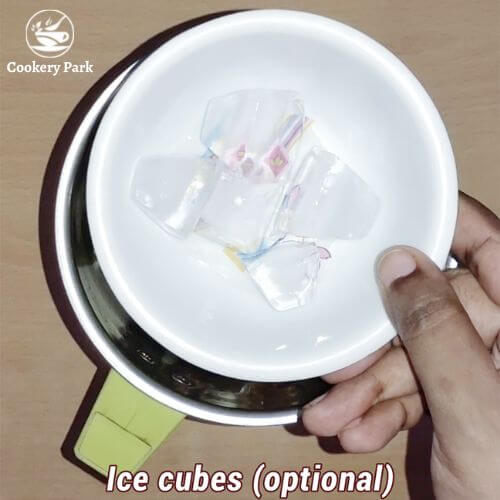
At what (x,y) coordinates should I click in order to perform the action: click on white bowl. Please return your answer as a coordinate pair (x, y). Image resolution: width=500 pixels, height=500 pixels. Looking at the image, I should click on (293, 341).